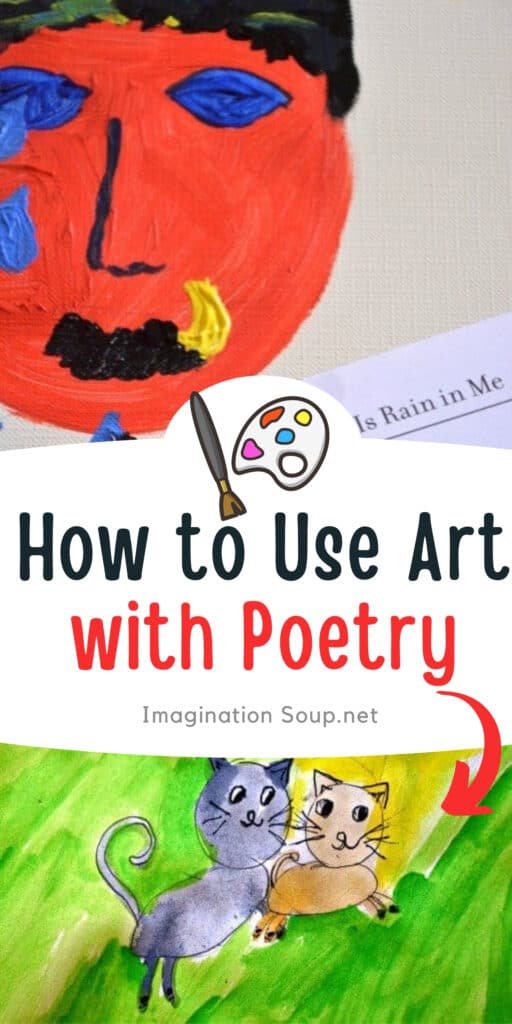
Identify the location of artwork. (240, 902), (90, 295).